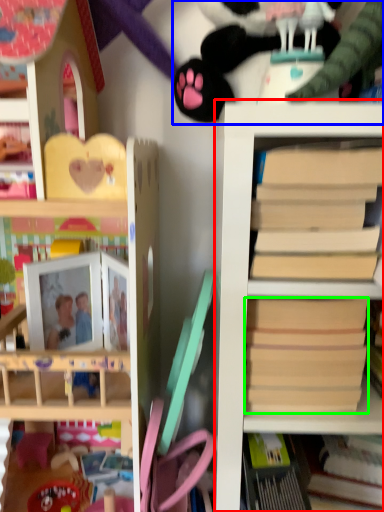
Question: Which object is the farthest from shelf (highlighted by a red box)? Choose among these: toy (highlighted by a blue box) or paperback book (highlighted by a green box).

Choices:
 (A) toy
 (B) paperback book

Answer: (A)